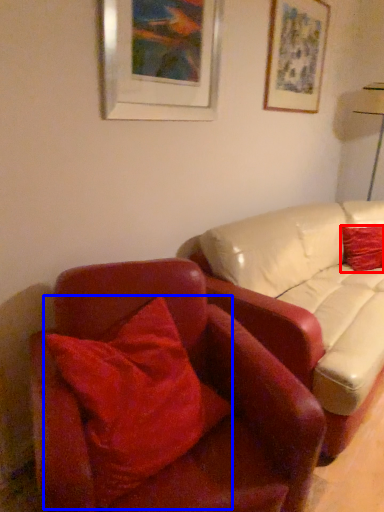
Question: Among these objects, which one is farthest to the camera, pillow (highlighted by a red box) or pillow (highlighted by a blue box)?

Choices:
 (A) pillow
 (B) pillow

Answer: (A)